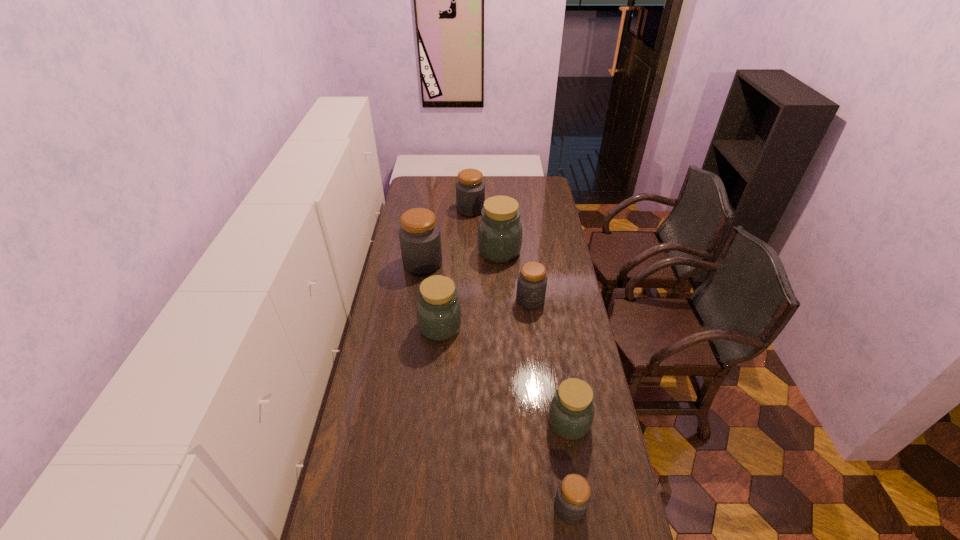
You are a GUI agent. You are given a task and a screenshot of the screen. Output one action in this format:
    pyautogui.click(x=<x>, y=<y>)
    Task: Click on the free space located 0.370m on the surface of the nearest object near the warning symbol
    The height and width of the screenshot is (540, 960).
    Given the screenshot: What is the action you would take?
    pyautogui.click(x=427, y=507)

Find the location of a particular element. This screenshot has height=540, width=960. free space located on the surface of the nearest object near the warning symbol is located at coordinates click(427, 507).

Identify the location of vacant space situated on the surface of the nearest object near the warning symbol. The image size is (960, 540). (462, 507).

I want to click on object at the left edge, so click(x=420, y=241).

Locate an element on the screen. vacant space at the far edge is located at coordinates (516, 188).

You are a GUI agent. You are given a task and a screenshot of the screen. Output one action in this format:
    pyautogui.click(x=<x>, y=<y>)
    Task: Click on the free space at the left edge of the desktop
    
    Given the screenshot: What is the action you would take?
    pyautogui.click(x=364, y=383)

You are a GUI agent. You are given a task and a screenshot of the screen. Output one action in this format:
    pyautogui.click(x=<x>, y=<y>)
    Task: Click on the vacant space at the right edge of the desktop
    Image resolution: width=960 pixels, height=540 pixels.
    Given the screenshot: What is the action you would take?
    pyautogui.click(x=612, y=447)

Identify the location of vacant space that's between the smallest green jar and the farthest jar. (519, 316).

I want to click on free space between the second green jar from left to right and the shortest object, so click(535, 379).

The image size is (960, 540). What are the coordinates of `vacant area that lies between the nearest object and the biggest gray jar` in the screenshot? It's located at (496, 385).